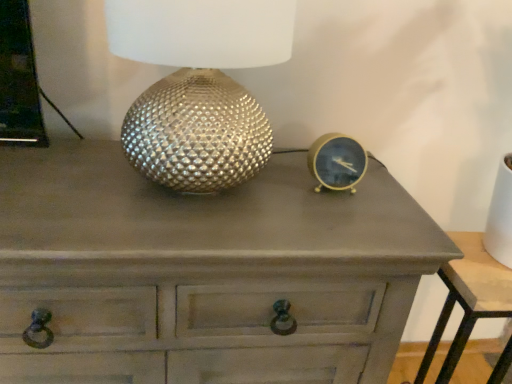
This screenshot has width=512, height=384. In order to click on vacant region to the left of metallic textured lamp at center in this screenshot , I will do `click(65, 172)`.